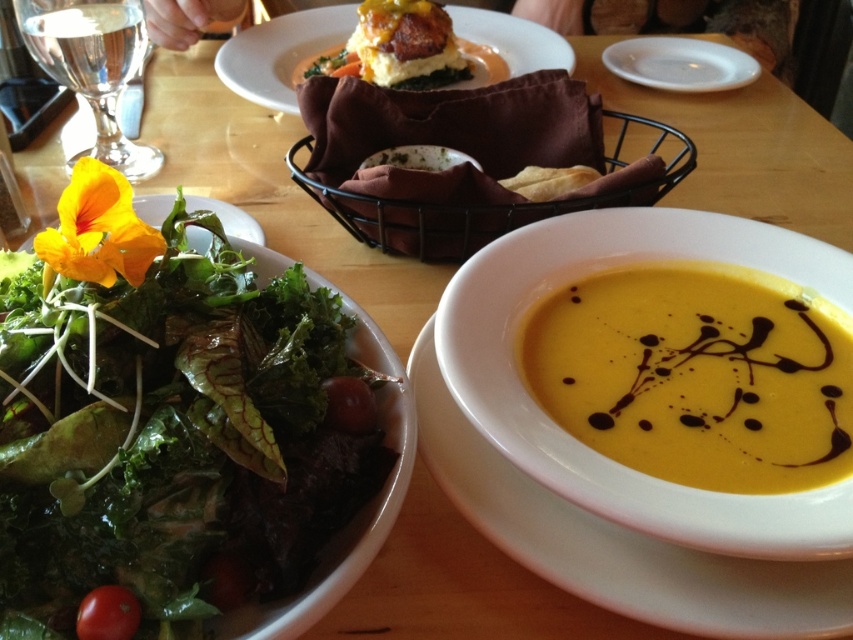
What are the coordinates of the yellow matte soup bowl at center?

The yellow matte soup bowl at center is located at coordinates point (618, 541).

You are a food critic evaluating the presentation of dishes on a table. You notice the yellow creamy soup at center and the red smooth tomato at lower left. Which dish occupies more horizontal space on the table?

The yellow creamy soup at center might be wider than red smooth tomato at lower left, so it likely occupies more horizontal space on the table.

You are a server who needs to place a 12 inch long utensil between the yellow matte soup bowl at center and the matte brown plate at upper center. Can the utensil fit between them without touching either dish?

The yellow matte soup bowl at center and the matte brown plate at upper center are 21.36 inches apart from each other. Since the utensil is 12 inches long, there is enough space between them to place the utensil without touching either dish.